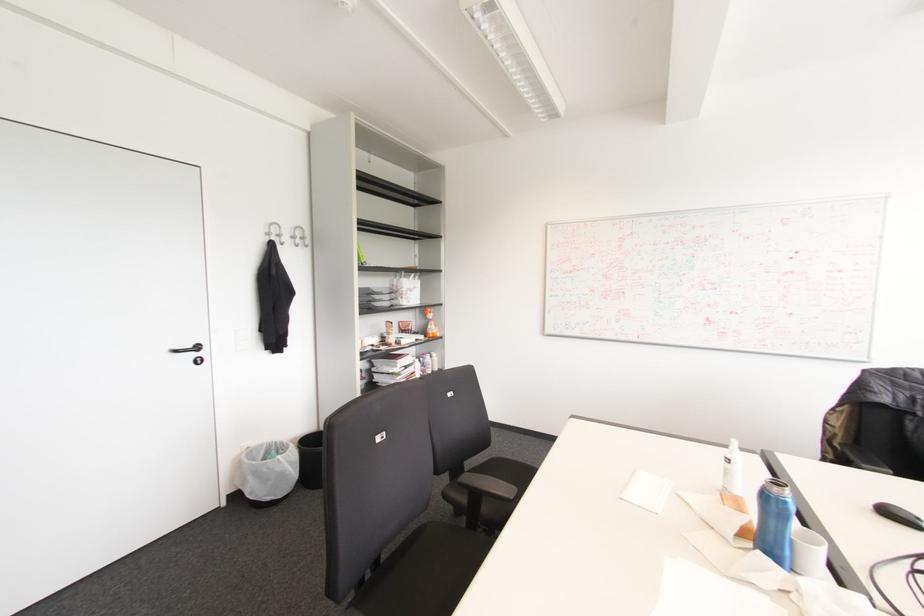
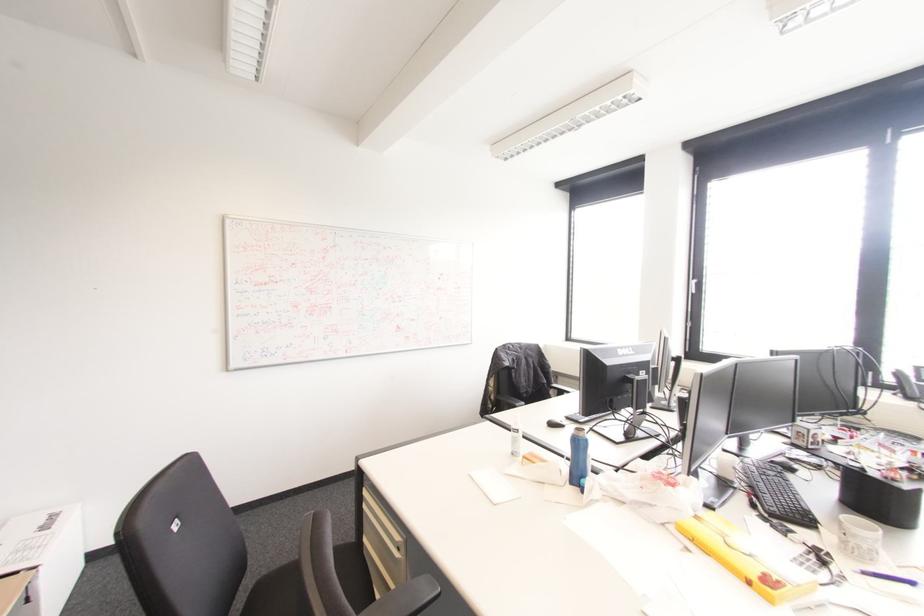
Question: The camera is either moving clockwise (left) or counter-clockwise (right) around the object. The first image is from the beginning of the video and the second image is from the end. Is the camera moving left or right when shooting the video?

Choices:
 (A) Left
 (B) Right

Answer: (A)